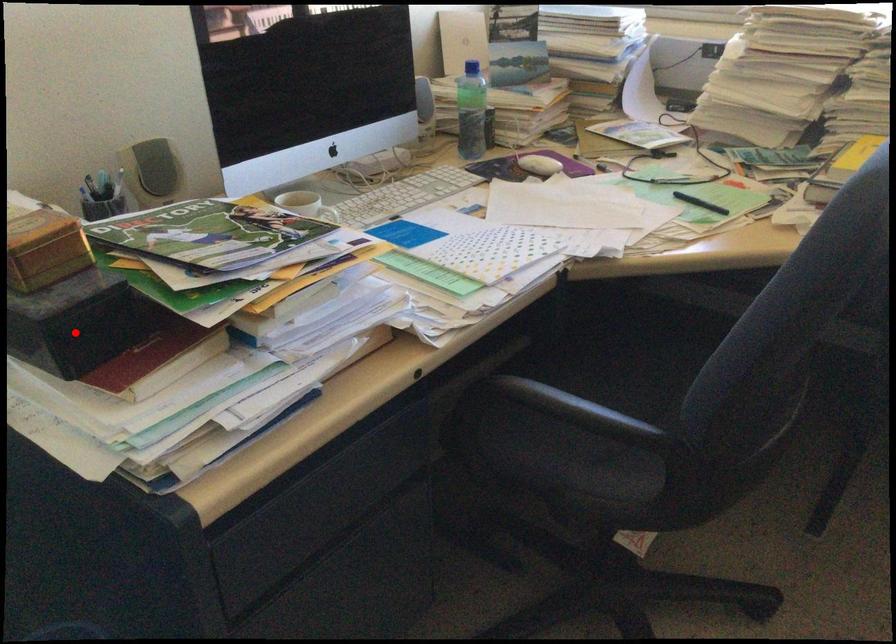
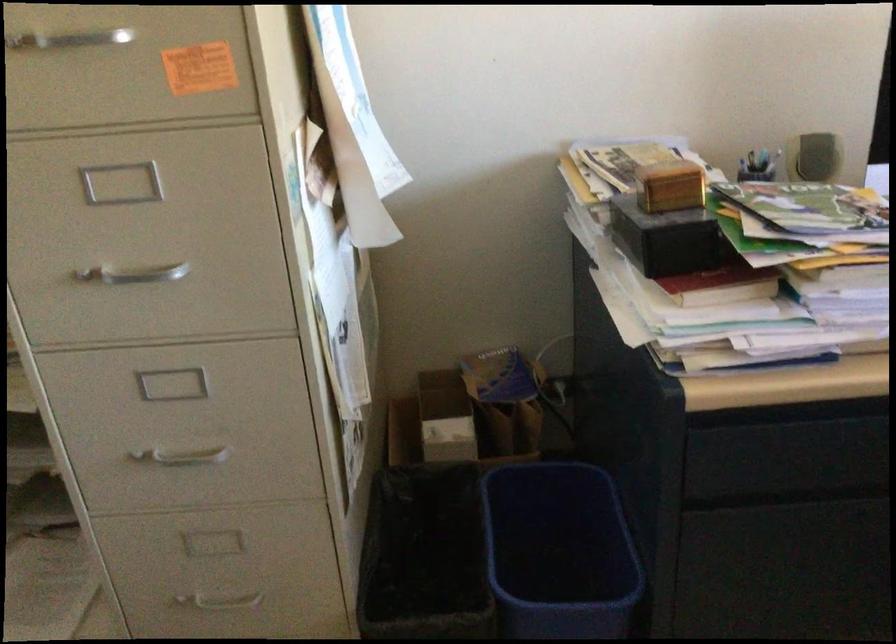
In the second image, find the point that corresponds to the highlighted location in the first image.

(668, 239)